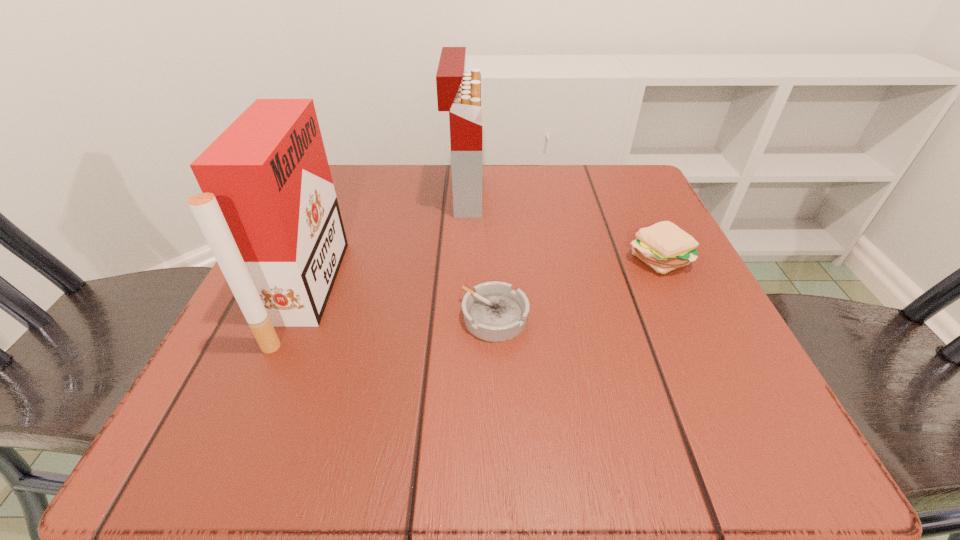
You are a GUI agent. You are given a task and a screenshot of the screen. Output one action in this format:
    pyautogui.click(x=<x>, y=<y>)
    Task: Click on the free space located 0.130m on the back of the ashtray
    
    Given the screenshot: What is the action you would take?
    pyautogui.click(x=492, y=245)

You are a GUI agent. You are given a task and a screenshot of the screen. Output one action in this format:
    pyautogui.click(x=<x>, y=<y>)
    Task: Click on the object located at the far edge
    
    Given the screenshot: What is the action you would take?
    pyautogui.click(x=460, y=93)

This screenshot has height=540, width=960. I want to click on object that is at the left edge, so click(x=268, y=210).

At what (x,y) coordinates should I click in order to perform the action: click on object that is positioned at the right edge. Please return your answer as a coordinate pair (x, y). This screenshot has height=540, width=960. Looking at the image, I should click on (663, 246).

This screenshot has height=540, width=960. Identify the location of free space at the far edge of the desktop. (534, 167).

Locate an element on the screen. The image size is (960, 540). vacant space at the right edge is located at coordinates (688, 281).

The height and width of the screenshot is (540, 960). I want to click on blank space at the far left corner of the desktop, so click(346, 166).

You are a GUI agent. You are given a task and a screenshot of the screen. Output one action in this format:
    pyautogui.click(x=<x>, y=<y>)
    Task: Click on the vacant position at the near left corner of the desktop
    The height and width of the screenshot is (540, 960).
    Given the screenshot: What is the action you would take?
    pyautogui.click(x=220, y=456)

This screenshot has width=960, height=540. I want to click on vacant space at the far right corner of the desktop, so click(x=640, y=211).

The image size is (960, 540). What are the coordinates of `free space at the near right corner` in the screenshot? It's located at (768, 423).